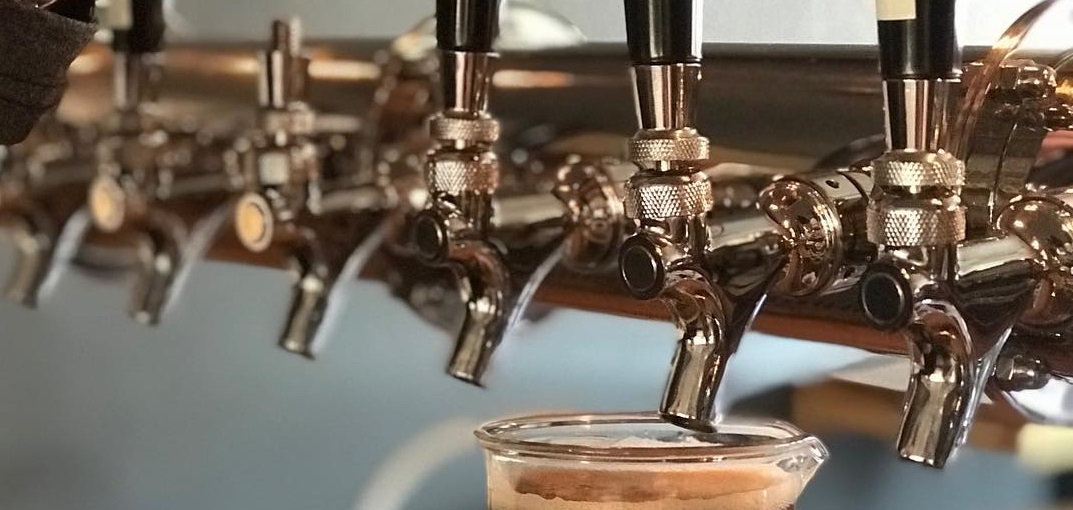
Locate an element on the screen. drink dispensers is located at coordinates (477, 256), (284, 257), (142, 198), (655, 278), (903, 317).